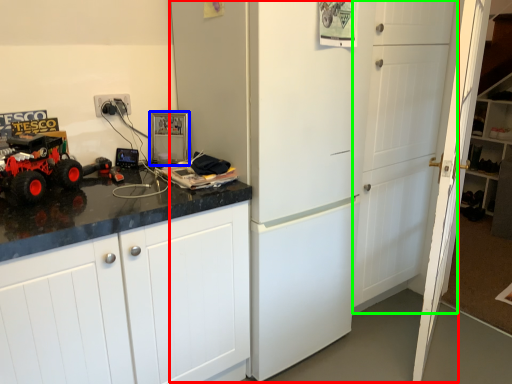
Question: Based on their relative distances, which object is farther from refrigerator (highlighted by a red box)? Choose from appliance (highlighted by a blue box) and door (highlighted by a green box).

Choices:
 (A) appliance
 (B) door

Answer: (A)